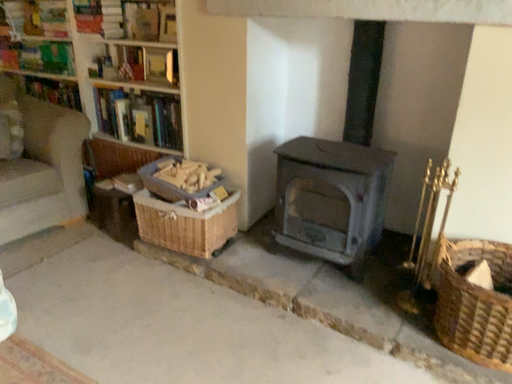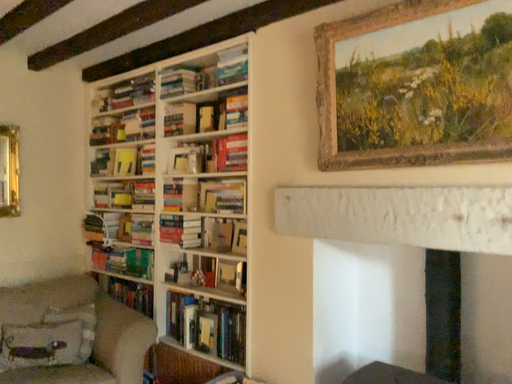
Question: How did the camera likely rotate when shooting the video?

Choices:
 (A) rotated right
 (B) rotated left

Answer: (B)